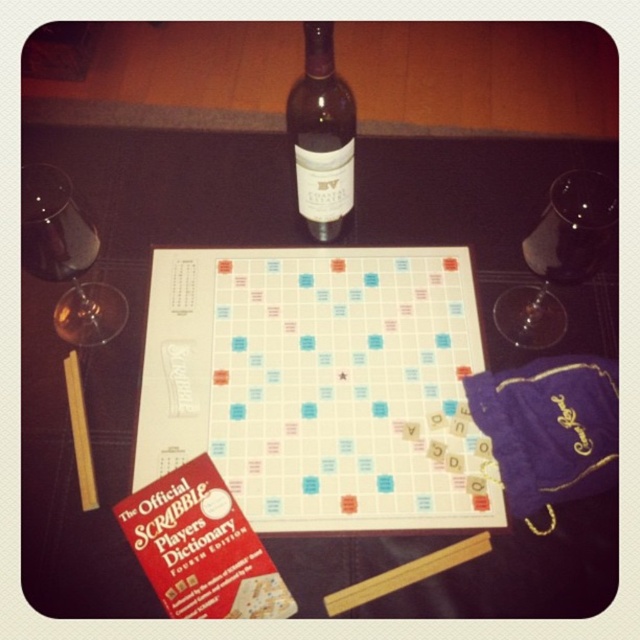
Question: Based on their relative distances, which object is farther from the transparent glass at left?

Choices:
 (A) white plastic board at center
 (B) dark brown glass bottle at upper center

Answer: (B)

Question: Can you confirm if transparent glass at left is wider than dark brown glass bottle at upper center?

Choices:
 (A) yes
 (B) no

Answer: (A)

Question: From the image, what is the correct spatial relationship of transparent glass at upper right in relation to transparent glass at left?

Choices:
 (A) above
 (B) below

Answer: (A)

Question: Can you confirm if white plastic board at center is positioned to the right of transparent glass at upper right?

Choices:
 (A) yes
 (B) no

Answer: (B)

Question: Based on their relative distances, which object is nearer to the white plastic board at center?

Choices:
 (A) transparent glass at left
 (B) transparent glass at upper right
 (C) white matte board game at center
 (D) dark brown glass bottle at upper center

Answer: (C)

Question: Which point is closer to the camera?

Choices:
 (A) (355, 259)
 (B) (300, 152)

Answer: (B)